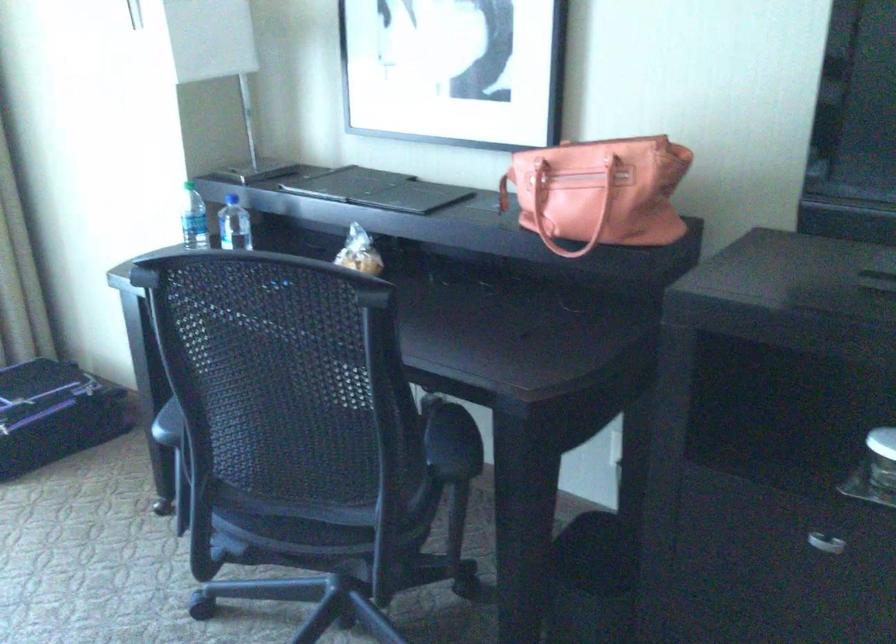
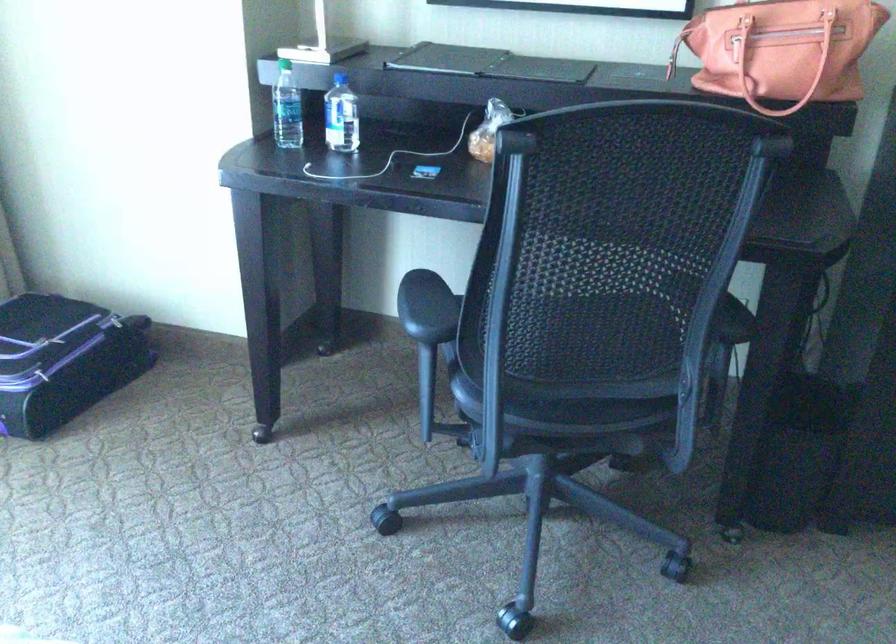
Question: The camera is either moving clockwise (left) or counter-clockwise (right) around the object. The first image is from the beginning of the video and the second image is from the end. Is the camera moving left or right when shooting the video?

Choices:
 (A) Left
 (B) Right

Answer: (A)